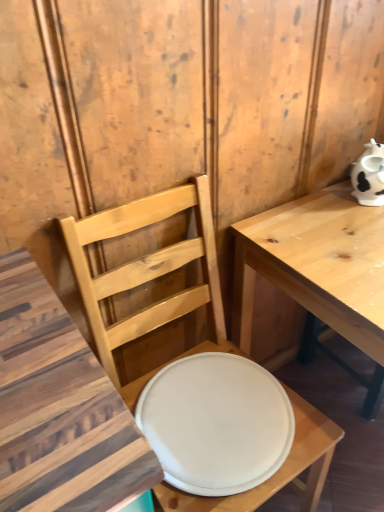
Question: Does light wood table at right come behind white matte plate at center?

Choices:
 (A) yes
 (B) no

Answer: (B)

Question: Can you confirm if light wood table at right is wider than white matte plate at center?

Choices:
 (A) no
 (B) yes

Answer: (B)

Question: From a real-world perspective, is light wood table at right located beneath white matte plate at center?

Choices:
 (A) yes
 (B) no

Answer: (A)

Question: Is light wood table at right located outside white matte plate at center?

Choices:
 (A) yes
 (B) no

Answer: (A)

Question: Would you say light wood table at right is a long distance from white matte plate at center?

Choices:
 (A) no
 (B) yes

Answer: (A)

Question: Is light wood table at right thinner than white matte plate at center?

Choices:
 (A) no
 (B) yes

Answer: (A)

Question: Is white matte plate at center placed right next to light wood table at right?

Choices:
 (A) yes
 (B) no

Answer: (B)

Question: Considering the relative sizes of white matte plate at center and light wood table at right in the image provided, is white matte plate at center smaller than light wood table at right?

Choices:
 (A) no
 (B) yes

Answer: (B)

Question: Is white matte plate at center positioned far away from light wood table at right?

Choices:
 (A) no
 (B) yes

Answer: (A)

Question: Does white matte plate at center have a larger size compared to light wood table at right?

Choices:
 (A) no
 (B) yes

Answer: (A)

Question: Does white matte plate at center have a greater width compared to light wood table at right?

Choices:
 (A) yes
 (B) no

Answer: (B)

Question: Can you confirm if white matte plate at center is positioned to the left of light wood table at right?

Choices:
 (A) no
 (B) yes

Answer: (B)

Question: Are matte wood chair at center and light wood table at right making contact?

Choices:
 (A) no
 (B) yes

Answer: (A)